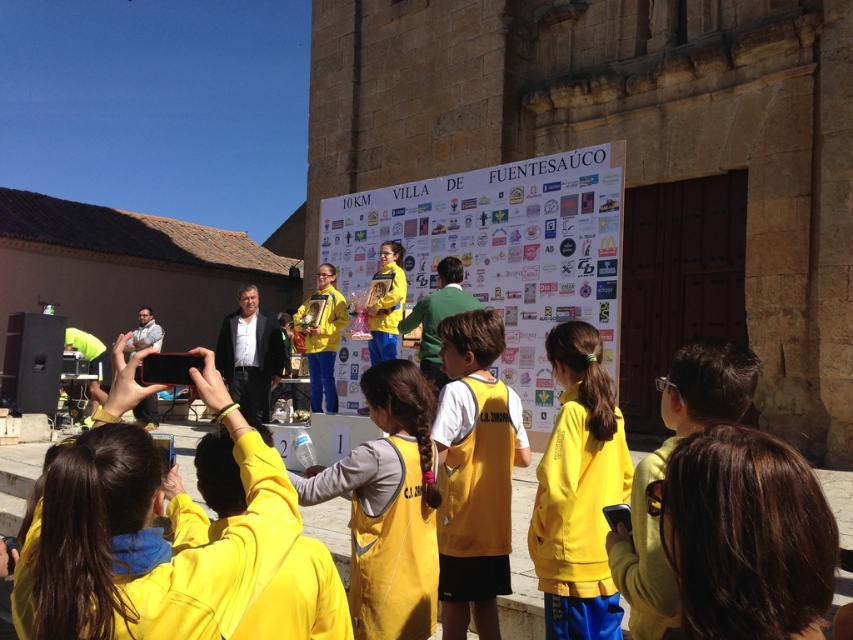
Which is below, brown smooth hair at lower center or yellow fabric shirt at center?

yellow fabric shirt at center is lower down.

Does point (778, 609) lie behind point (489, 445)?

No, it is not.

Locate an element on the screen. brown smooth hair at lower center is located at coordinates (746, 536).

Does yellow fabric jacket at center appear on the left side of yellow matte jacket at center?

Yes, yellow fabric jacket at center is to the left of yellow matte jacket at center.

Image resolution: width=853 pixels, height=640 pixels. I want to click on yellow fabric jacket at center, so click(x=387, y=506).

This screenshot has height=640, width=853. I want to click on yellow fabric jacket at center, so click(x=387, y=506).

Which is in front, point (550, 467) or point (660, 554)?

Positioned in front is point (660, 554).

Does point (540, 522) come closer to viewer compared to point (628, 540)?

No, (540, 522) is behind (628, 540).

Who is more forward, (572, 522) or (689, 360)?

Point (689, 360)

You are a GUI agent. You are given a task and a screenshot of the screen. Output one action in this format:
    pyautogui.click(x=<x>, y=<y>)
    Task: Click on the yellow matte jacket at center
    This screenshot has height=640, width=853.
    Given the screenshot: What is the action you would take?
    pyautogui.click(x=578, y=490)